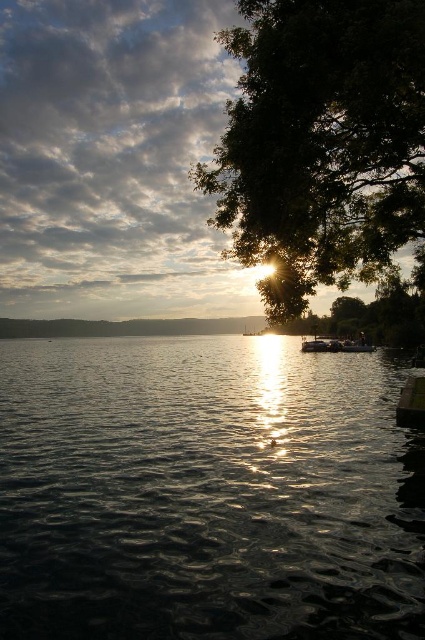
Is glistening dark water at center bigger than green leafy tree at upper right?

No, glistening dark water at center is not bigger than green leafy tree at upper right.

Who is lower down, glistening dark water at center or green leafy tree at upper right?

glistening dark water at center is below.

Where is `glistening dark water at center`? The image size is (425, 640). glistening dark water at center is located at coordinates (206, 492).